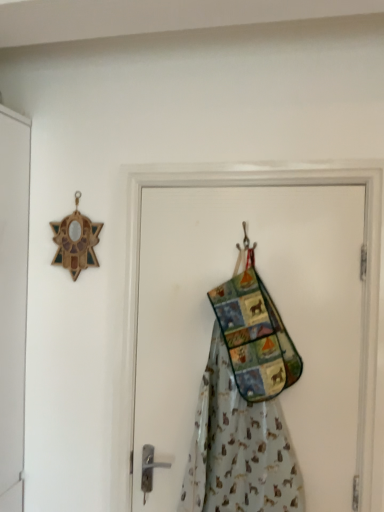
Question: Is metallic hook at center taller or shorter than textured fabric apron at center?

Choices:
 (A) tall
 (B) short

Answer: (B)

Question: In the image, is metallic hook at center positioned in front of or behind textured fabric apron at center?

Choices:
 (A) front
 (B) behind

Answer: (B)

Question: Which object is the farthest from the metallic hook at center?

Choices:
 (A) fabric patchwork bag at center
 (B) textured fabric apron at center

Answer: (B)

Question: Considering the real-world distances, which object is farthest from the textured fabric apron at center?

Choices:
 (A) metallic hook at center
 (B) fabric patchwork bag at center

Answer: (A)